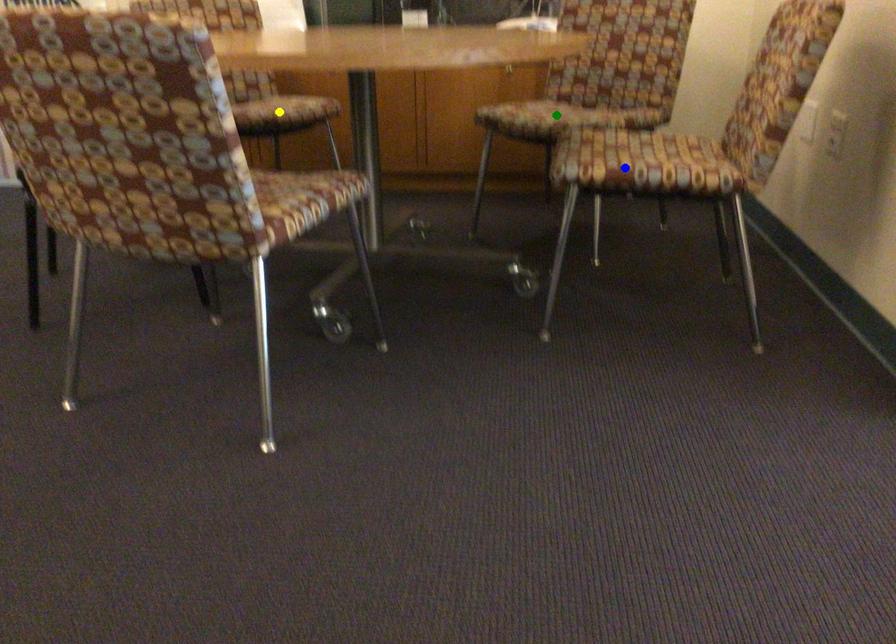
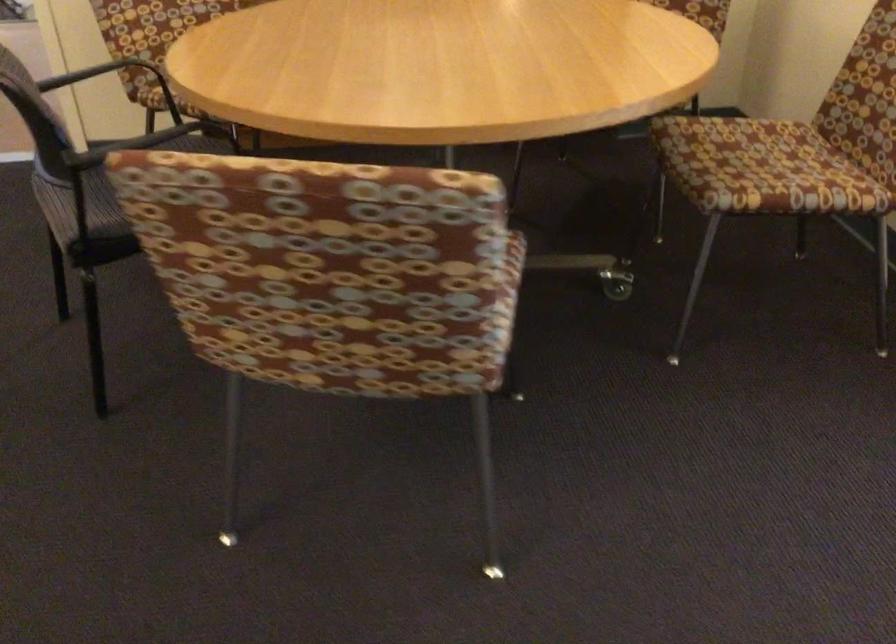
I am providing you with two images of the same scene from different viewpoints. Three points are marked in image1. Which point corresponds to a part or object that is occluded in image2?In image1, three points are marked. Which of them correspond to a part or object that is occluded in image2?Among the three points shown in image1, which one corresponds to a part or object that is no longer visible due to occlusion in image2?

Invisible in image2: yellow point, green point.